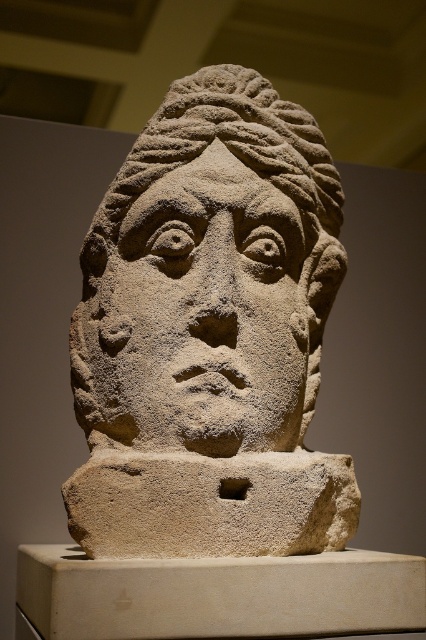
Does sandstone head at center appear under stone textured face at center?

No.

Consider the image. Is sandstone head at center to the left of stone textured face at center from the viewer's perspective?

In fact, sandstone head at center is to the right of stone textured face at center.

Is point (282, 312) closer to camera compared to point (296, 284)?

Yes, it is.

This screenshot has width=426, height=640. What are the coordinates of `sandstone head at center` in the screenshot? It's located at (210, 333).